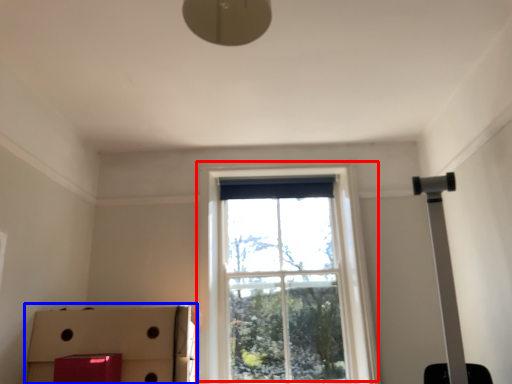
Question: Which of the following is the farthest to the observer, window (highlighted by a red box) or cardboard box (highlighted by a blue box)?

Choices:
 (A) window
 (B) cardboard box

Answer: (A)